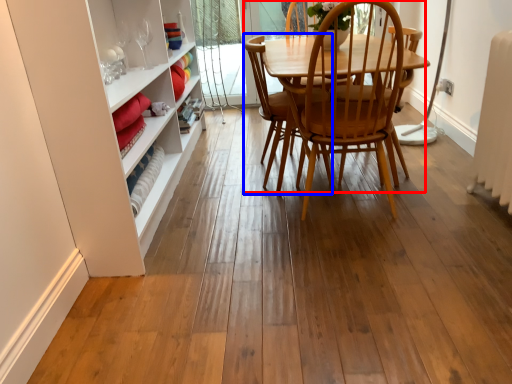
Question: Among these objects, which one is nearest to the camera, chair (highlighted by a red box) or armchair (highlighted by a blue box)?

Choices:
 (A) chair
 (B) armchair

Answer: (A)